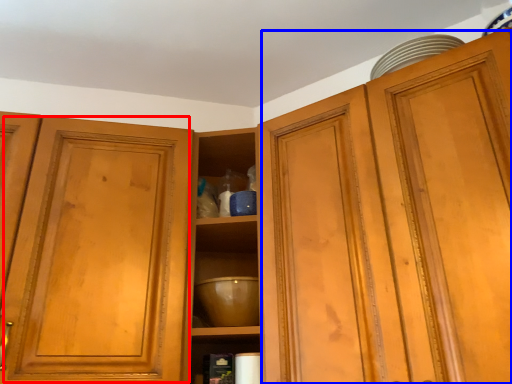
Question: Which of the following is the farthest to the observer, glass door (highlighted by a red box) or cabinetry (highlighted by a blue box)?

Choices:
 (A) glass door
 (B) cabinetry

Answer: (A)